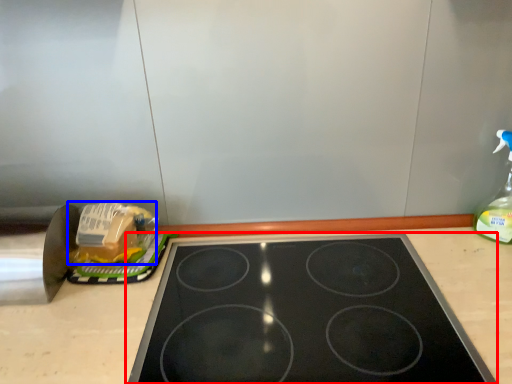
Question: Which of the following is the closest to the observer, gas stove (highlighted by a red box) or food (highlighted by a blue box)?

Choices:
 (A) gas stove
 (B) food

Answer: (A)